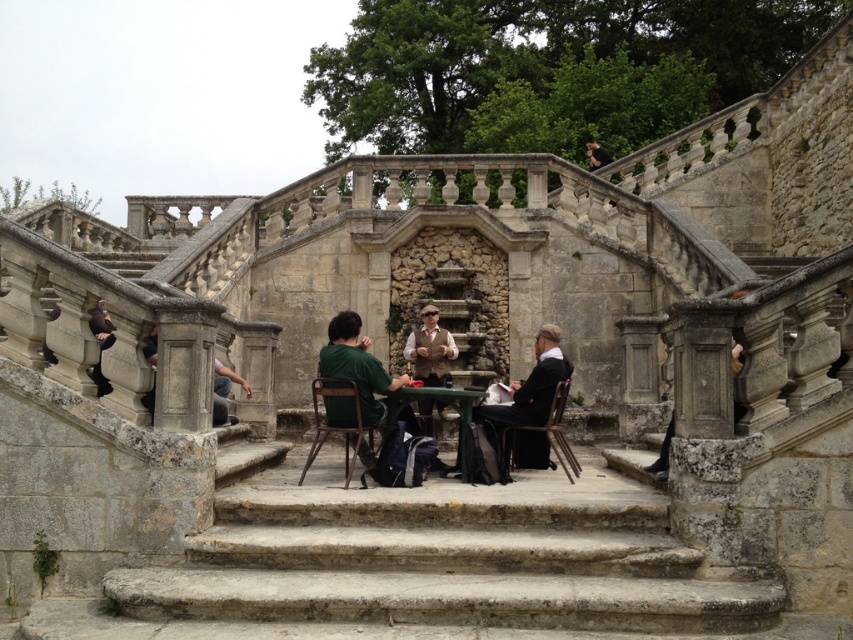
Which is below, green fabric shirt at center or green matte table at center?

green matte table at center is below.

Is green fabric shirt at center positioned behind green matte table at center?

No, green fabric shirt at center is closer to the viewer.

Which is in front, point (341, 321) or point (466, 435)?

Point (466, 435)

Where is `green fabric shirt at center`? This screenshot has width=853, height=640. green fabric shirt at center is located at coordinates (357, 368).

Does dark suit at center have a greater width compared to green fabric shirt at center?

Incorrect, dark suit at center's width does not surpass green fabric shirt at center's.

The width and height of the screenshot is (853, 640). What are the coordinates of `dark suit at center` in the screenshot? It's located at (526, 394).

Between dark suit at center and green matte table at center, which one has less height?

Standing shorter between the two is green matte table at center.

Is dark suit at center taller than green matte table at center?

Indeed, dark suit at center has a greater height compared to green matte table at center.

Does point (485, 404) come closer to viewer compared to point (469, 396)?

That is False.

I want to click on dark suit at center, so click(526, 394).